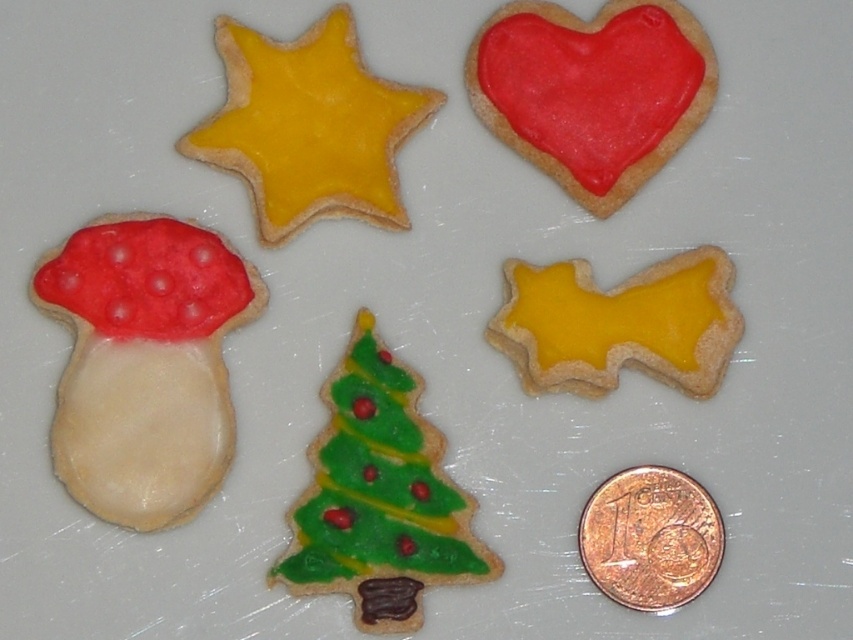
You are a child trying to find the red glossy heart at upper right and the green matte christmas tree at center. According to the scene, which cookie is positioned to the right side compared to the other?

The red glossy heart at upper right is positioned to the right of the green matte christmas tree at center.

You are a baker arranging cookies on a tray. You have a yellow matte star at upper left and a copper metallic coin at lower right. Which cookie is taller?

The yellow matte star at upper left is much taller than the copper metallic coin at lower right.

You are a baker who wants to stack the red glossy heart at upper right and the green matte christmas tree at center vertically. Which cookie should you place at the bottom to ensure stability?

The green matte christmas tree at center should be placed at the bottom because it is taller than the red glossy heart at upper right, providing a more stable base.